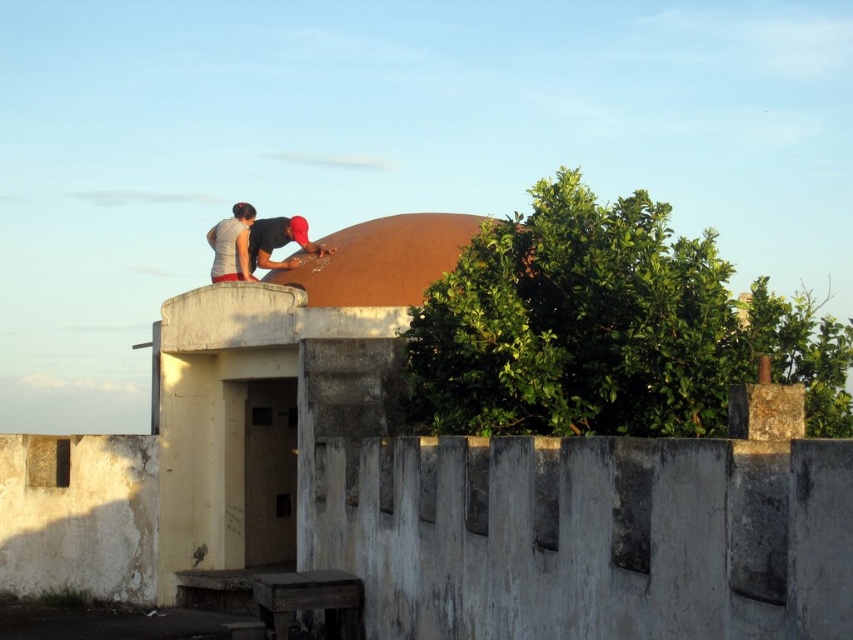
Based on the photo, you are standing on the rooftop and want to place a new small potted plant. You have two spots in mind near the brown matte dome at center and the matte black shirt at upper center. Which location would allow the plant to have more space around it?

The matte black shirt at upper center would allow the plant to have more space around it since the brown matte dome at center is smaller in size compared to the matte black shirt at upper center.

You are a fashion designer observing a rooftop scene. You notice two shirts displayed at the upper center of the image. Which shirt is positioned lower between the matte gray shirt at upper center and the matte black shirt at upper center?

The matte gray shirt at upper center is positioned lower than the matte black shirt at upper center according to the description.

In the scene shown: You are a delivery drone that needs to fly over the rooftop scene. You must pass between the brown matte dome at center and the matte gray shirt at upper center. Can you safely navigate this path if your drone is 0.5 meters tall?

The brown matte dome at center has a lesser height compared to the matte gray shirt at upper center. Since the drone is 0.5 meters tall, it can safely navigate between them as long as the vertical clearance is sufficient. However, the exact height difference isn